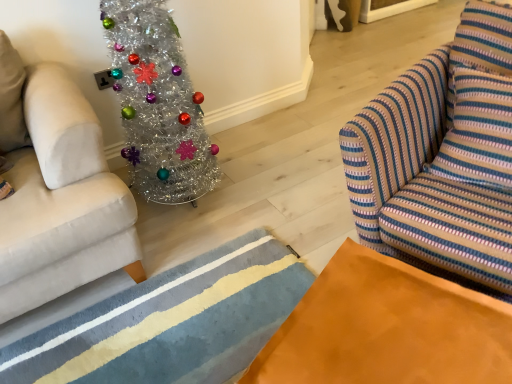
Where is `vacant space to the right of shiny silver christmas tree at left`? The height and width of the screenshot is (384, 512). vacant space to the right of shiny silver christmas tree at left is located at coordinates (257, 182).